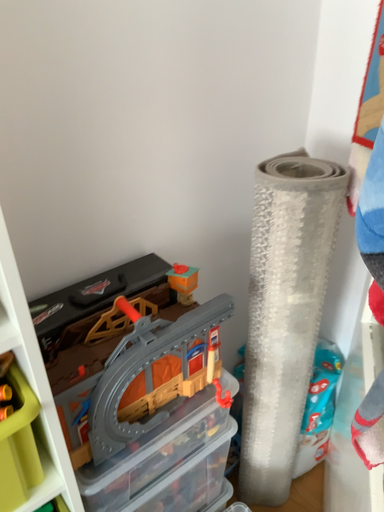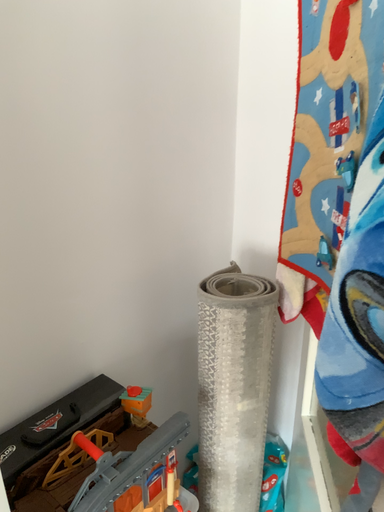
Question: How did the camera likely rotate when shooting the video?

Choices:
 (A) rotated right
 (B) rotated left

Answer: (A)